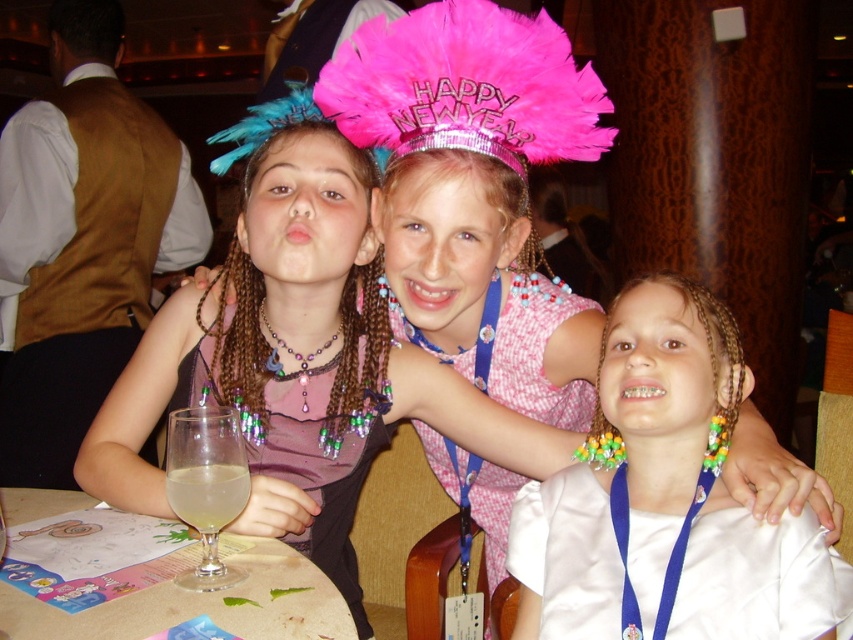
Question: From the image, what is the correct spatial relationship of pink feathered crown at center in relation to translucent glass at table left?

Choices:
 (A) above
 (B) below

Answer: (A)

Question: Can you confirm if wooden table at center is smaller than clear glass wine glass at lower left?

Choices:
 (A) yes
 (B) no

Answer: (B)

Question: Is white satin shirt at center thinner than pink feathered crown at center?

Choices:
 (A) yes
 (B) no

Answer: (A)

Question: Which object is positioned farthest from the pink feathered crown at center?

Choices:
 (A) white satin shirt at center
 (B) wooden table at center
 (C) purple satin dress at center
 (D) clear glass wine glass at lower left

Answer: (B)

Question: Which of the following is the closest to the observer?

Choices:
 (A) (171, 502)
 (B) (186, 614)
 (C) (486, 22)

Answer: (B)

Question: Which point is closer to the camera?

Choices:
 (A) white satin shirt at center
 (B) purple satin dress at center
 (C) translucent glass at table left

Answer: (C)